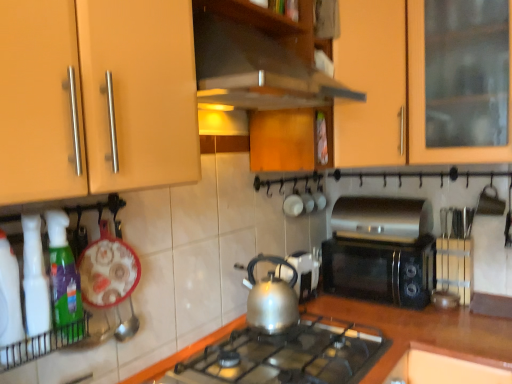
You are a GUI agent. You are given a task and a screenshot of the screen. Output one action in this format:
    pyautogui.click(x=<x>, y=<y>)
    Task: Click on the free spot above wooden at center (from a real-world perspective)
    Image resolution: width=512 pixels, height=384 pixels.
    Given the screenshot: What is the action you would take?
    pyautogui.click(x=399, y=312)